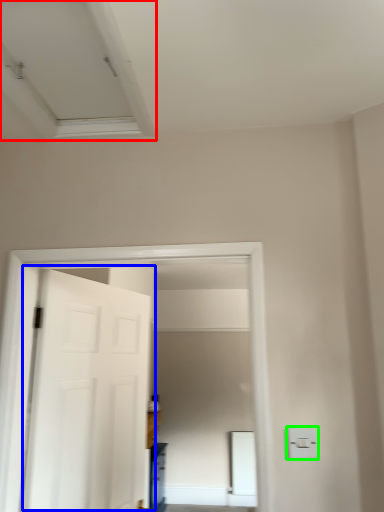
Question: Considering the real-world distances, which object is farthest from exhaust hood (highlighted by a red box)? door (highlighted by a blue box) or light switch (highlighted by a green box)?

Choices:
 (A) door
 (B) light switch

Answer: (B)